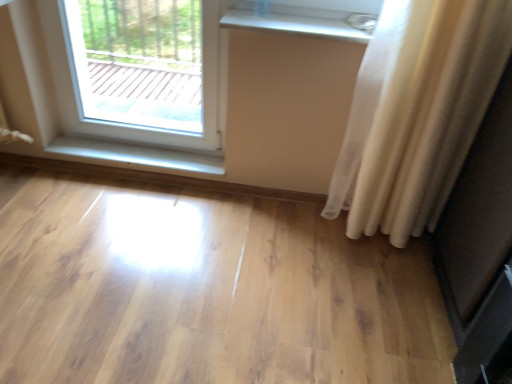
Question: Considering the relative positions of light wood floor at center and white glossy radiator at upper center, the second window sill when ordered from bottom to top, in the image provided, is light wood floor at center to the left or to the right of white glossy radiator at upper center, the second window sill when ordered from bottom to top,?

Choices:
 (A) right
 (B) left

Answer: (B)

Question: Looking at their shapes, would you say light wood floor at center is wider or thinner than white glossy radiator at upper center, placed as the 1th window sill when sorted from top to bottom?

Choices:
 (A) wide
 (B) thin

Answer: (A)

Question: Estimate the real-world distances between objects in this image. Which object is closer to the light wood floor at center?

Choices:
 (A) clear glass window at upper left
 (B) matte black screen door at right
 (C) white glossy radiator at upper center, positioned as the second window sill in back-to-front order
 (D) white glossy wood at lower left, which is counted as the 1th window sill, starting from the left
 (E) white sheer curtain at right

Answer: (E)

Question: Which of these objects is positioned closest to the white glossy wood at lower left, acting as the 2th window sill starting from the right?

Choices:
 (A) white glossy radiator at upper center, the first window sill positioned from the right
 (B) light wood floor at center
 (C) white sheer curtain at right
 (D) clear glass window at upper left
 (E) matte black screen door at right

Answer: (B)